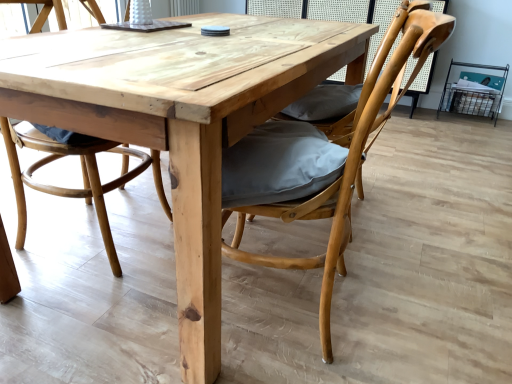
Locate an element on the screen. vacant space in natural wood chair at center, the 2th chair viewed from the right (from a real-world perspective) is located at coordinates coord(62,223).